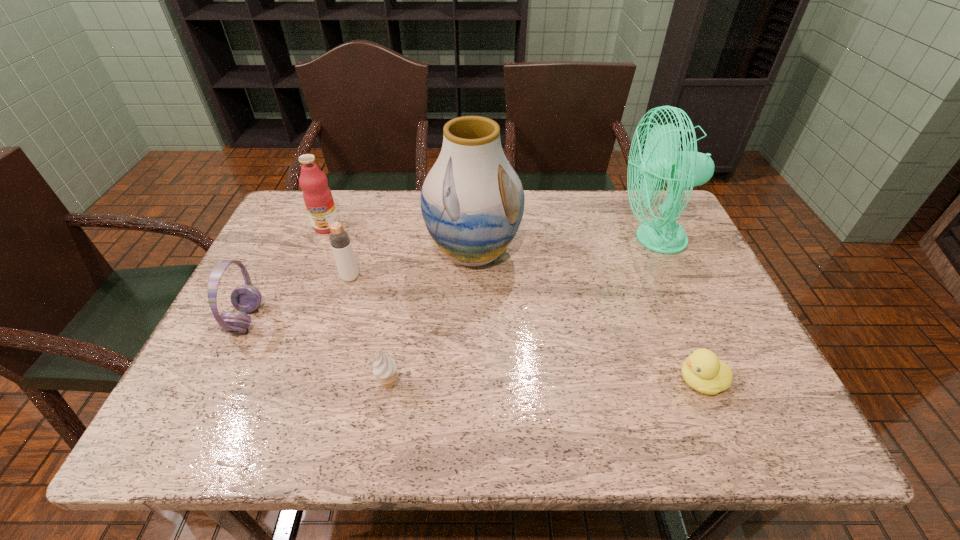
Where is `fan`? Image resolution: width=960 pixels, height=540 pixels. fan is located at coordinates (661, 158).

I want to click on vase, so click(x=472, y=201).

Identify the location of fruit juice. This screenshot has width=960, height=540. (317, 196).

The width and height of the screenshot is (960, 540). What are the coordinates of `the second object from left to right` in the screenshot? It's located at (317, 196).

The image size is (960, 540). What are the coordinates of `bottle` in the screenshot? It's located at (339, 239).

You are a GUI agent. You are given a task and a screenshot of the screen. Output one action in this format:
    pyautogui.click(x=<x>, y=<y>)
    Task: Click on the third nearest object
    
    Given the screenshot: What is the action you would take?
    pyautogui.click(x=246, y=298)

In order to click on headset in this screenshot , I will do `click(246, 298)`.

You are a GUI agent. You are given a task and a screenshot of the screen. Output one action in this format:
    pyautogui.click(x=<x>, y=<y>)
    Task: Click on the fourth object from right to left
    
    Given the screenshot: What is the action you would take?
    pyautogui.click(x=385, y=368)

Where is `the second shortest object`? the second shortest object is located at coordinates (385, 368).

Where is `the shortest object`? the shortest object is located at coordinates (702, 370).